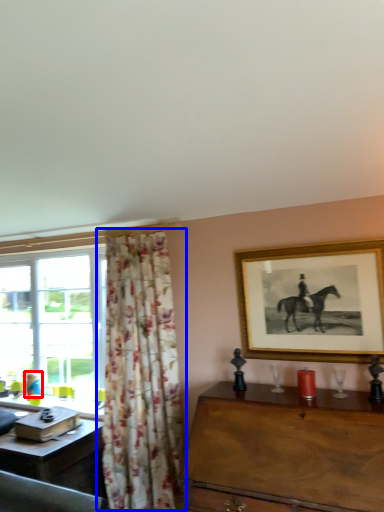
Question: Which of the following is the farthest to the observer, person (highlighted by a red box) or curtain (highlighted by a blue box)?

Choices:
 (A) person
 (B) curtain

Answer: (A)